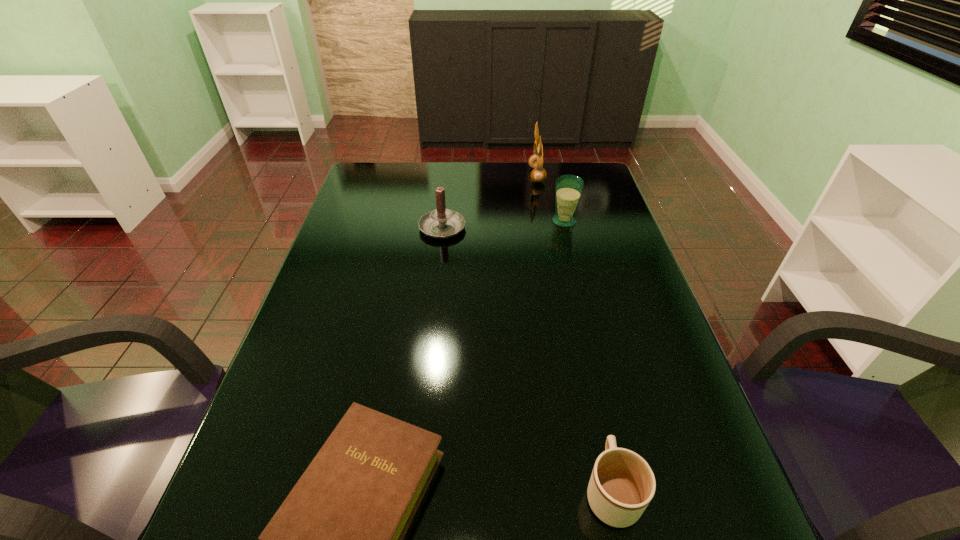
Find the location of a particular element. This screenshot has height=540, width=960. free spot that satisfies the following two spatial constraints: 1. on the side of the second shortest object with the handle; 2. on the front-facing side of the earphone is located at coordinates (543, 175).

Locate an element on the screen. This screenshot has width=960, height=540. free space that satisfies the following two spatial constraints: 1. on the side of the mug with the handle; 2. on the front-facing side of the earphone is located at coordinates (543, 175).

This screenshot has width=960, height=540. Find the location of `vacant space that satisfies the following two spatial constraints: 1. on the side of the candle with the handle loop; 2. on the right side of the glass`. vacant space that satisfies the following two spatial constraints: 1. on the side of the candle with the handle loop; 2. on the right side of the glass is located at coordinates (443, 221).

Identify the location of vacant space that satisfies the following two spatial constraints: 1. on the front-facing side of the tallest object; 2. on the left side of the glass. The height and width of the screenshot is (540, 960). (545, 221).

The height and width of the screenshot is (540, 960). I want to click on free space in the image that satisfies the following two spatial constraints: 1. on the back side of the glass; 2. on the front-facing side of the farthest object, so click(553, 175).

You are a GUI agent. You are given a task and a screenshot of the screen. Output one action in this format:
    pyautogui.click(x=<x>, y=<y>)
    Task: Click on the vacant position in the image that satisfies the following two spatial constraints: 1. on the side of the candle with the handle loop; 2. on the right side of the glass
    
    Given the screenshot: What is the action you would take?
    pyautogui.click(x=443, y=221)